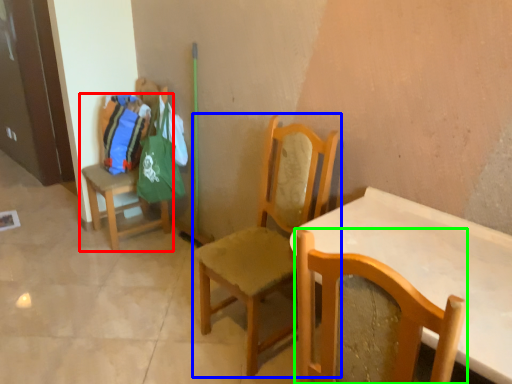
Question: Which is nearer to the chair (highlighted by a red box)? chair (highlighted by a blue box) or chair (highlighted by a green box).

Choices:
 (A) chair
 (B) chair

Answer: (A)